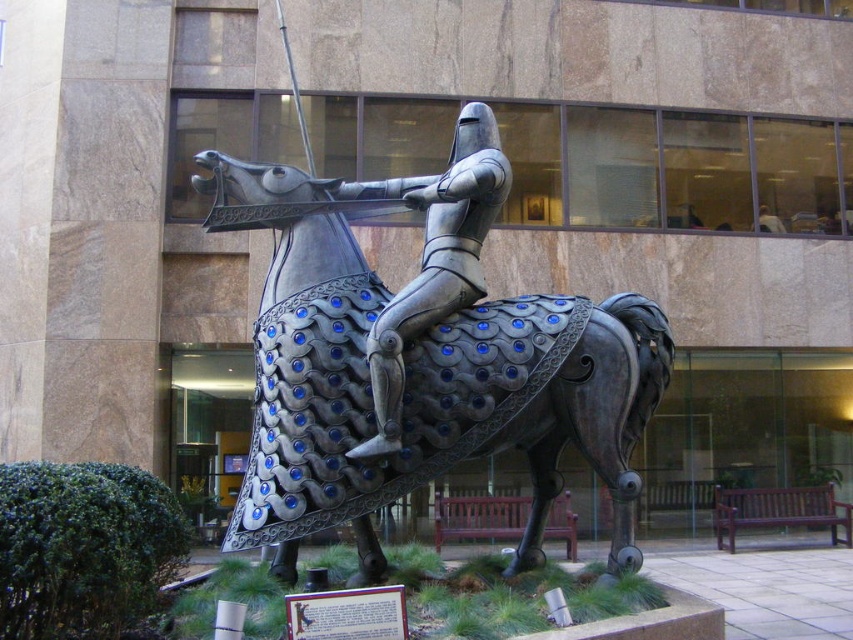
You are an art student standing in front of the sculpture and want to sketch the details of both the metallic armor at center and the shiny silver armor at center. Which armor should you focus on first to capture its finer details more clearly?

The metallic armor at center is closer to the viewer than the shiny silver armor at center, so you should focus on sketching the metallic armor at center first to capture its finer details more clearly.

You are an art student analyzing the sculpture of the knight and horse. You notice two distinct sections of armor on the knight. Which section, the metallic armor at center or the shiny silver armor at center, occupies a greater area in the sculpture?

The metallic armor at center occupies a greater area in the sculpture than the shiny silver armor at center as it is larger in size according to the description.

You are standing in front of the sculpture of the knight and horse. There are two points marked on the sculpture, one at point coordinates (279, 294) and the other at point coordinates (476, 134). If you were to touch both points with your finger, which point would feel closer to your hand?

Point (279, 294) is closer to the camera than point (476, 134), so touching point (279, 294) would feel closer to your hand.